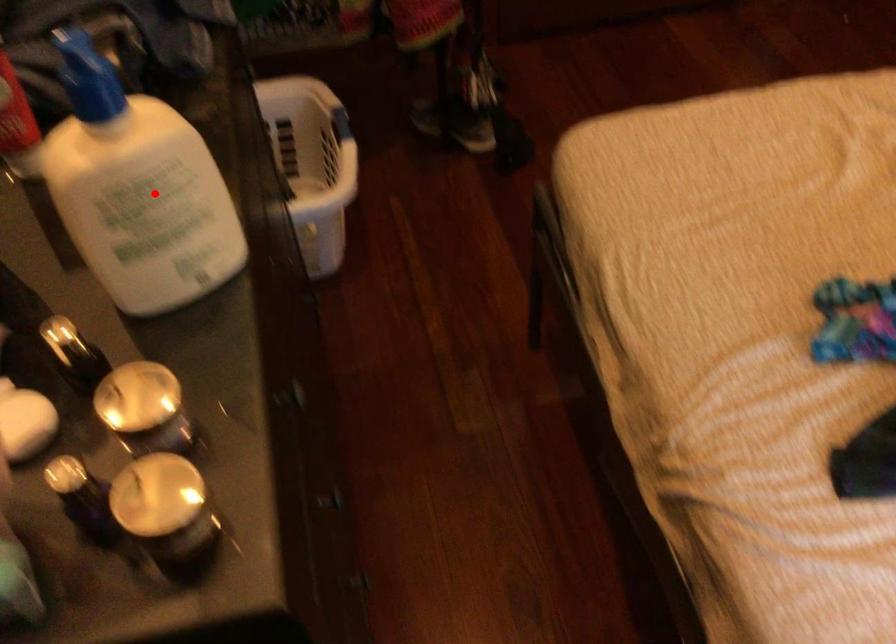
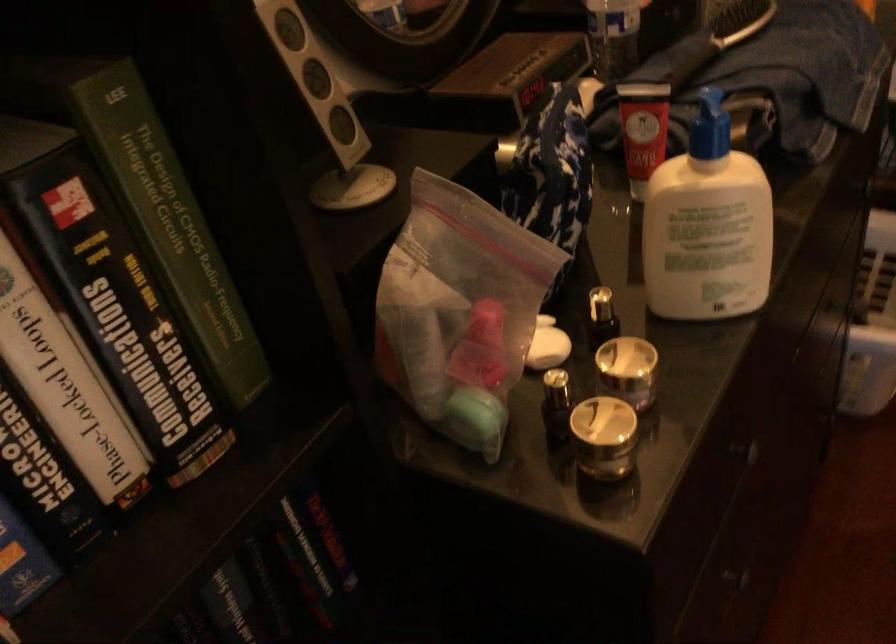
Question: I am providing you with two images of the same scene from different viewpoints. In image1, a red point is highlighted. Considering the same 3D point in image2, which of the following is correct?

Choices:
 (A) It is closer
 (B) It is farther

Answer: (B)